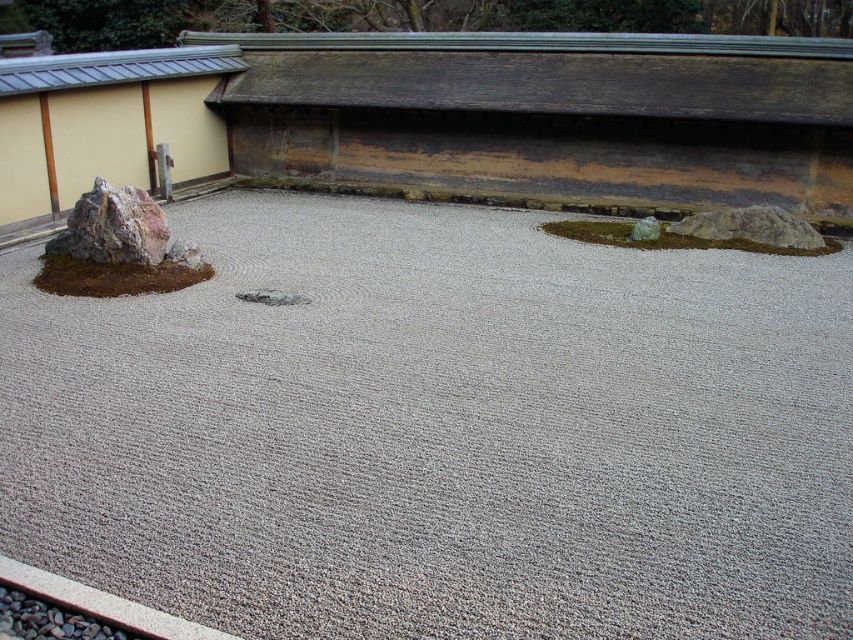
Is rough textured rock at left thinner than smooth gray rock at center-right?

No.

Is point (163, 240) positioned in front of point (648, 216)?

Yes.

This screenshot has height=640, width=853. What are the coordinates of `rough textured rock at left` in the screenshot? It's located at (113, 227).

How distant is gray gravel at center from rough textured rock at left?

gray gravel at center is 11.55 feet away from rough textured rock at left.

Is point (369, 545) less distant than point (164, 252)?

Yes.

At what (x,y) coordinates should I click in order to perform the action: click on gray gravel at center. Please return your answer as a coordinate pair (x, y). Looking at the image, I should click on (439, 429).

Consider the image. Is gray gravel at center bigger than gray gravel at bottom left?

Correct, gray gravel at center is larger in size than gray gravel at bottom left.

Between gray gravel at center and gray gravel at bottom left, which one has less height?

gray gravel at bottom left is shorter.

At what (x,y) coordinates should I click in order to perform the action: click on gray gravel at center. Please return your answer as a coordinate pair (x, y). The height and width of the screenshot is (640, 853). Looking at the image, I should click on (439, 429).